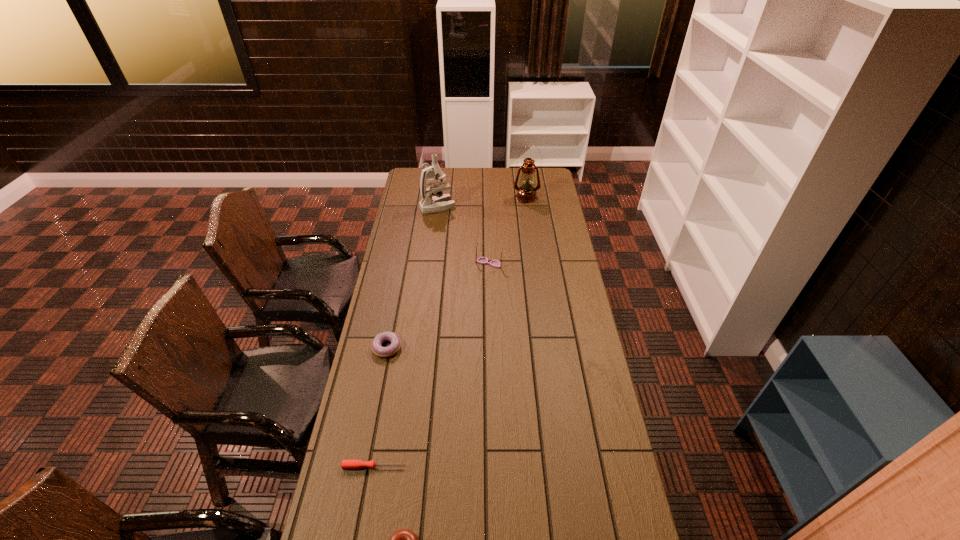
You are a GUI agent. You are given a task and a screenshot of the screen. Output one action in this format:
    pyautogui.click(x=<x>, y=<y>)
    Task: Click on the oil lamp
    Image resolution: width=960 pixels, height=540 pixels.
    Given the screenshot: What is the action you would take?
    pyautogui.click(x=526, y=193)

This screenshot has width=960, height=540. What are the coordinates of `microscope` in the screenshot? It's located at click(440, 202).

Where is `spectacles`? The height and width of the screenshot is (540, 960). spectacles is located at coordinates (482, 260).

I want to click on the second object from right to left, so click(x=482, y=260).

The width and height of the screenshot is (960, 540). What are the coordinates of `the farther doughnut` in the screenshot? It's located at (393, 348).

Find the location of a particular element. the left doughnut is located at coordinates (393, 348).

This screenshot has height=540, width=960. Identify the location of screwdriver. (345, 464).

What are the coordinates of `the shortest object` in the screenshot? It's located at (345, 464).

Find the location of a particular element. Image resolution: width=960 pixels, height=540 pixels. vacant space located 0.070m on the left of the oil lamp is located at coordinates (500, 197).

Identify the location of free region located 0.080m on the back of the microscope. (440, 191).